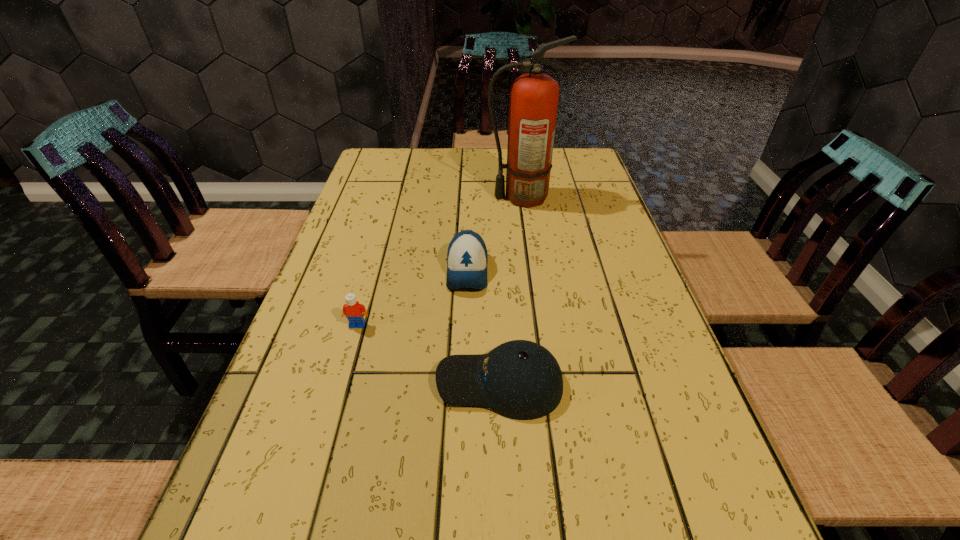
Where is `the tallest object`? This screenshot has width=960, height=540. the tallest object is located at coordinates (533, 103).

Where is `fire extinguisher`? fire extinguisher is located at coordinates (533, 103).

This screenshot has width=960, height=540. I want to click on the farther baseball cap, so click(467, 256).

This screenshot has width=960, height=540. Find the location of `the third farthest object`. the third farthest object is located at coordinates (352, 309).

At what (x,y) coordinates should I click in order to perform the action: click on Lego. Please return your answer as a coordinate pair (x, y). Looking at the image, I should click on tap(352, 309).

Identify the location of the nearer baseball cap. The image size is (960, 540). (521, 380).

Locate an element on the screen. free space located 0.130m on the nozzle of the tallest object is located at coordinates (444, 198).

The height and width of the screenshot is (540, 960). Identify the location of free space located 0.240m on the nozzle of the tallest object. (408, 198).

Locate an element on the screen. free region located 0.360m on the nozzle of the tallest object is located at coordinates (x=369, y=198).

Find the location of a particular element. The image size is (960, 540). vacant space located on the front-facing side of the second farthest object is located at coordinates (463, 402).